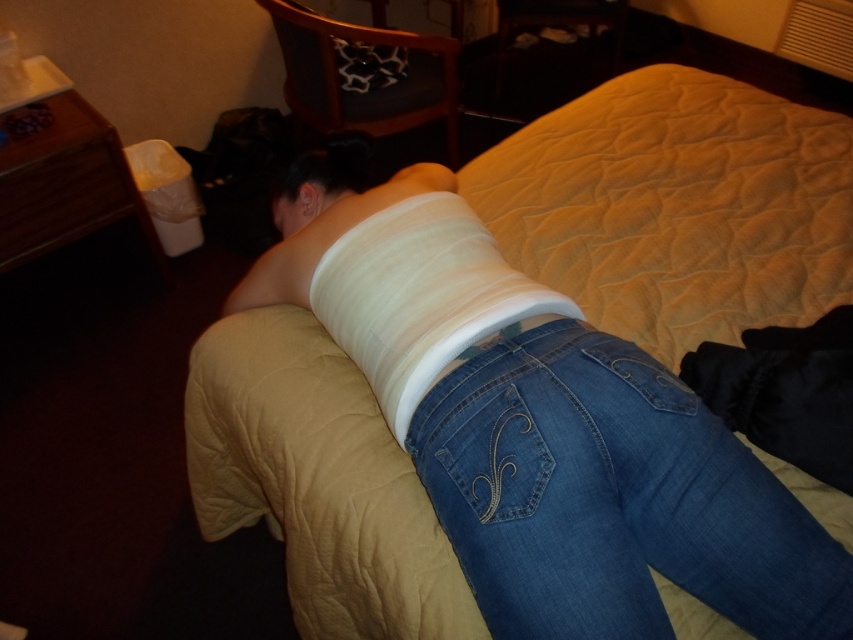
You are standing in the room and want to place a small lamp between the two points, point (717, 442) and point (432, 336). Which point should the lamp be closer to if you want it to be closer to the bed?

The lamp should be closer to point (717, 442) because it is in front of point (432, 336), meaning it is closer to the bed.

What is the position of the beige quilted bed at center in the image?

The beige quilted bed at center is located at point (677, 205).